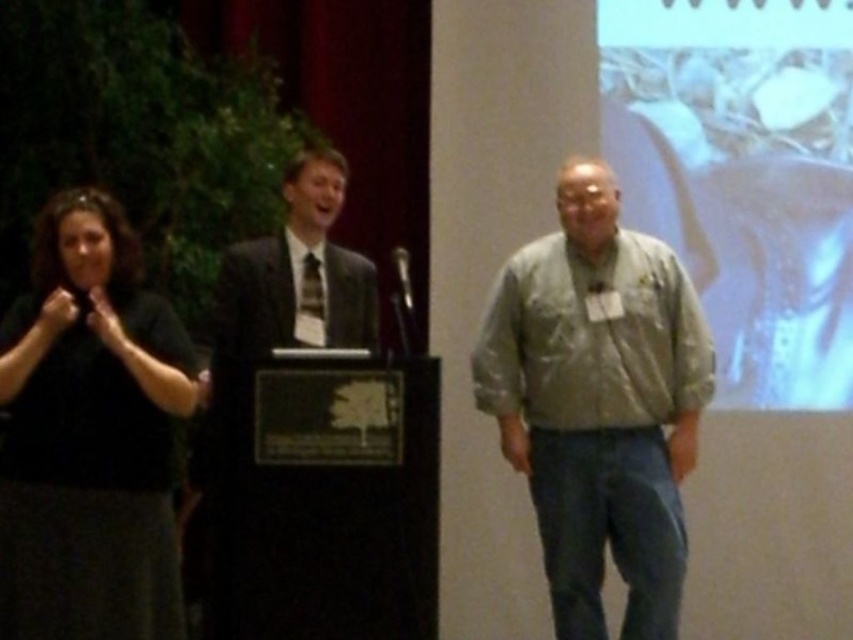
Measure the distance from white matte screen at upper right to light gray fabric shirt at center.

They are 1.22 meters apart.

Who is higher up, white matte screen at upper right or light gray fabric shirt at center?

white matte screen at upper right is higher up.

The width and height of the screenshot is (853, 640). Find the location of `white matte screen at upper right`. white matte screen at upper right is located at coordinates (743, 177).

Between white matte screen at upper right and dark suit at center, which one appears on the left side from the viewer's perspective?

dark suit at center

Can you confirm if white matte screen at upper right is shorter than dark suit at center?

No.

Find the location of a particular element. The height and width of the screenshot is (640, 853). white matte screen at upper right is located at coordinates (743, 177).

Is light gray fabric shirt at center closer to the viewer compared to dark suit at center?

No, it is not.

Find the location of `light gray fabric shirt at center`. light gray fabric shirt at center is located at coordinates (598, 403).